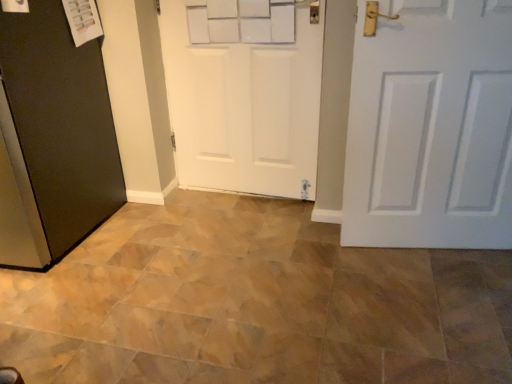
Question: In terms of width, does black matte door at left, placed as the first door when sorted from left to right, look wider or thinner when compared to white matte door at center, which is the 3th door from left to right?

Choices:
 (A) thin
 (B) wide

Answer: (B)

Question: Is black matte door at left, which appears as the 3th door when viewed from the right, spatially inside white matte door at center, which is the 3th door from left to right, or outside of it?

Choices:
 (A) inside
 (B) outside

Answer: (B)

Question: Which object is the farthest from the white matte door at center, which is the 3th door from left to right?

Choices:
 (A) white matte door at center, positioned as the second door in left-to-right order
 (B) black matte door at left, placed as the first door when sorted from left to right
 (C) brown ceramic tile at center

Answer: (B)

Question: Estimate the real-world distances between objects in this image. Which object is closer to the white matte door at center, positioned as the second door in left-to-right order?

Choices:
 (A) white matte door at center, which is the 3th door from left to right
 (B) brown ceramic tile at center
 (C) black matte door at left, placed as the first door when sorted from left to right

Answer: (A)